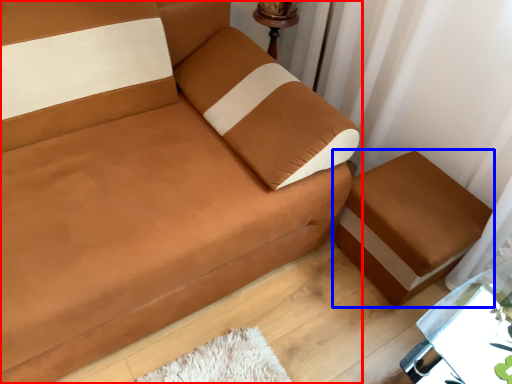
Question: Among these objects, which one is farthest to the camera, studio couch (highlighted by a red box) or furniture (highlighted by a blue box)?

Choices:
 (A) studio couch
 (B) furniture

Answer: (B)